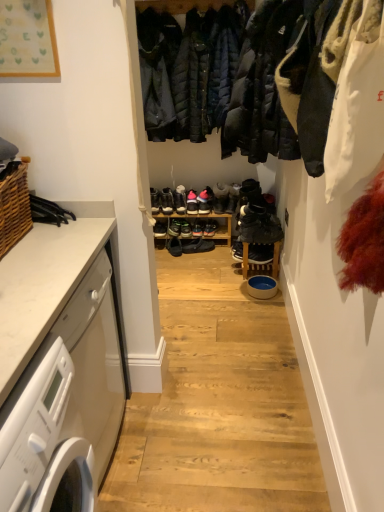
Question: Is the depth of white marble countertop at left less than that of shiny black sneaker at center, marked as the third footwear in a left-to-right arrangement?

Choices:
 (A) yes
 (B) no

Answer: (A)

Question: Is white marble countertop at left bigger than shiny black sneaker at center, marked as the 6th footwear in a right-to-left arrangement?

Choices:
 (A) yes
 (B) no

Answer: (A)

Question: Considering the relative positions of white marble countertop at left and shiny black sneaker at center, marked as the third footwear in a left-to-right arrangement, in the image provided, is white marble countertop at left behind shiny black sneaker at center, marked as the third footwear in a left-to-right arrangement,?

Choices:
 (A) no
 (B) yes

Answer: (A)

Question: Is white marble countertop at left shorter than shiny black sneaker at center, marked as the third footwear in a left-to-right arrangement?

Choices:
 (A) no
 (B) yes

Answer: (A)

Question: From a real-world perspective, is white marble countertop at left positioned over shiny black sneaker at center, marked as the 6th footwear in a right-to-left arrangement, based on gravity?

Choices:
 (A) no
 (B) yes

Answer: (B)

Question: In terms of width, does shiny black sneakers at center, the 2th footwear when ordered from left to right, look wider or thinner when compared to woven brown basket at left?

Choices:
 (A) thin
 (B) wide

Answer: (A)

Question: In the image, is shiny black sneakers at center, the 2th footwear when ordered from left to right, positioned in front of or behind woven brown basket at left?

Choices:
 (A) front
 (B) behind

Answer: (B)

Question: Considering the positions of point (180, 228) and point (26, 225), is point (180, 228) closer or farther from the camera than point (26, 225)?

Choices:
 (A) farther
 (B) closer

Answer: (A)

Question: From the image's perspective, is shiny black sneakers at center, the 2th footwear when ordered from left to right, located above or below woven brown basket at left?

Choices:
 (A) above
 (B) below

Answer: (A)

Question: In the image, is white glossy washing machine at left on the left side or the right side of shiny black sneakers at center, the seventh footwear positioned from the right?

Choices:
 (A) left
 (B) right

Answer: (A)

Question: Considering the positions of white glossy washing machine at left and shiny black sneakers at center, the 2th footwear when ordered from left to right, in the image, is white glossy washing machine at left bigger or smaller than shiny black sneakers at center, the 2th footwear when ordered from left to right,?

Choices:
 (A) small
 (B) big

Answer: (B)

Question: Is point (46, 429) positioned closer to the camera than point (188, 229)?

Choices:
 (A) farther
 (B) closer

Answer: (B)

Question: Is white glossy washing machine at left taller or shorter than shiny black sneakers at center, the seventh footwear positioned from the right?

Choices:
 (A) short
 (B) tall

Answer: (B)

Question: Considering the positions of pink suede sneakers at center, the 6th footwear viewed from the left, and white marble countertop at left in the image, is pink suede sneakers at center, the 6th footwear viewed from the left, taller or shorter than white marble countertop at left?

Choices:
 (A) short
 (B) tall

Answer: (A)

Question: Is pink suede sneakers at center, the 6th footwear viewed from the left, inside or outside of white marble countertop at left?

Choices:
 (A) outside
 (B) inside

Answer: (A)